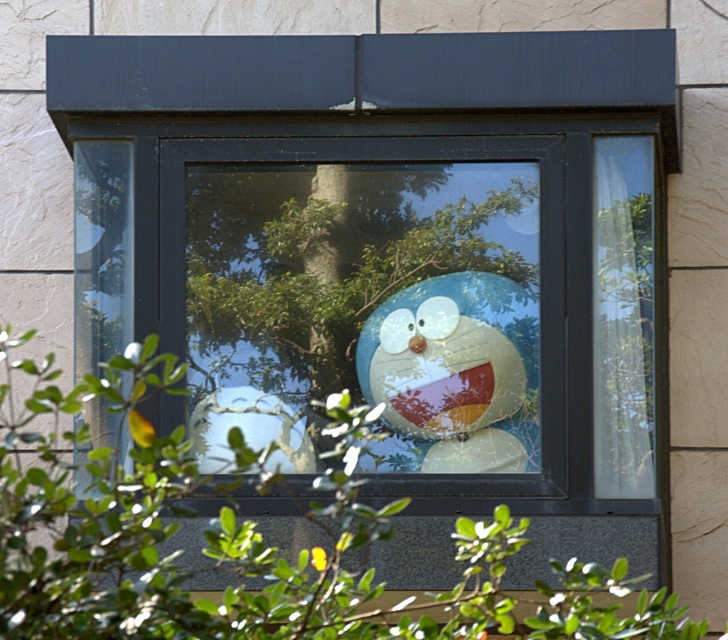
Can you confirm if green leafy tree at center is smaller than translucent plastic toy at center?

No, green leafy tree at center is not smaller than translucent plastic toy at center.

How far apart are green leafy tree at center and translucent plastic toy at center?

The distance of green leafy tree at center from translucent plastic toy at center is 26.00 centimeters.

Is point (67, 536) positioned after point (499, 404)?

No, (67, 536) is in front of (499, 404).

I want to click on green leafy tree at center, so click(x=202, y=531).